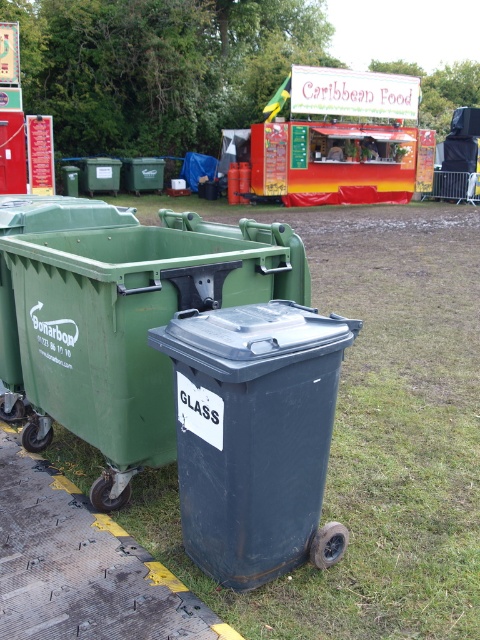
You are standing at the center of the image. Looking towards the lower right corner, can you see the green grass at lower right? Please state its location in coordinates.

Yes, the green grass at lower right is located at coordinates point [370,433].

You are a groundskeeper at the fair and need to place a new decorative planter that is 3 feet wide. You have two options for placement near the Caribbean food stall. The first option is next to the green grass at lower right, and the second is next to the matte black bin at center. Based on their sizes, which location would allow the planter to fit better without overcrowding the area?

The green grass at lower right is bigger than the matte black bin at center, so placing the planter next to the green grass at lower right would provide more space and prevent overcrowding.

You are a food vendor at the fair and need to place a new menu board next to the caribbean food cart at center and the matte gray bin at center. The menu board requires at least 1.2 meters of height to display all information clearly. Can both objects accommodate this requirement?

The caribbean food cart at center is taller than the matte gray bin at center. Since the menu board needs at least 1.2 meters in height, the caribbean food cart at center can accommodate the requirement, but the matte gray bin at center may not be tall enough.